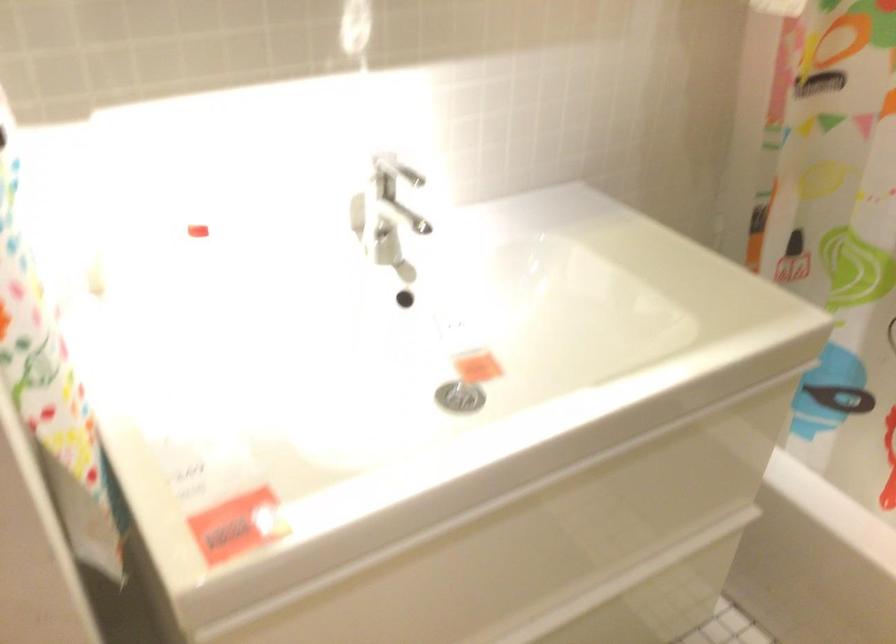
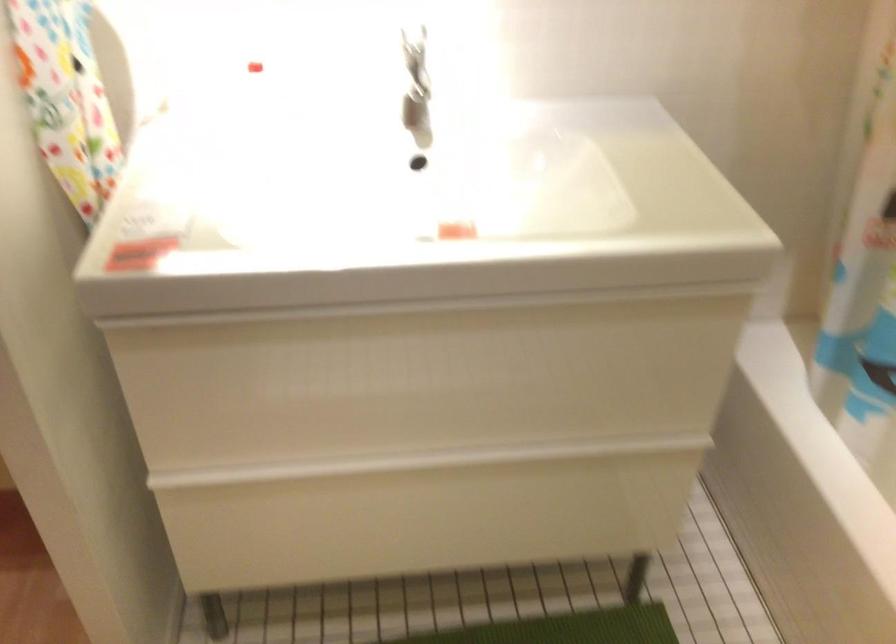
Question: The camera is either moving clockwise (left) or counter-clockwise (right) around the object. The first image is from the beginning of the video and the second image is from the end. Is the camera moving left or right when shooting the video?

Choices:
 (A) Left
 (B) Right

Answer: (B)